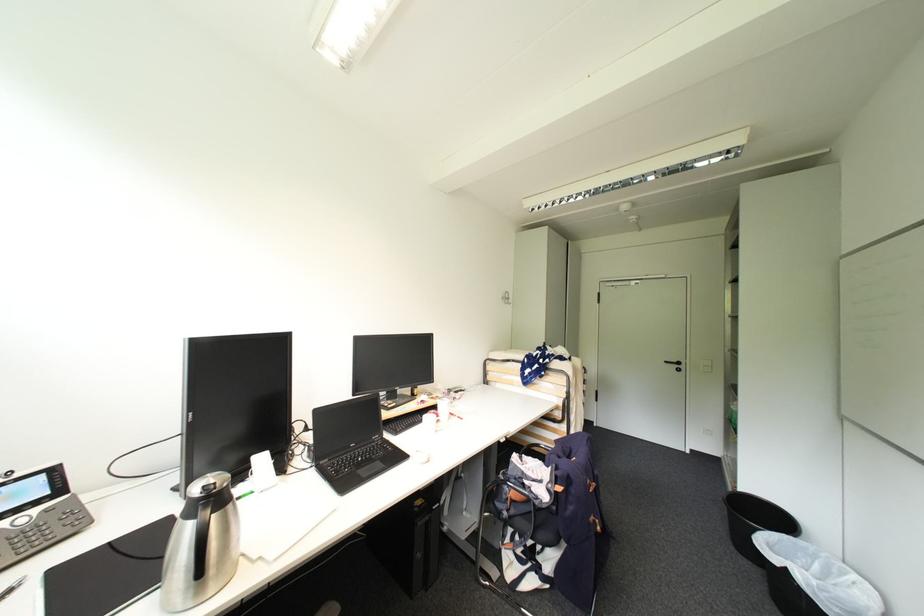
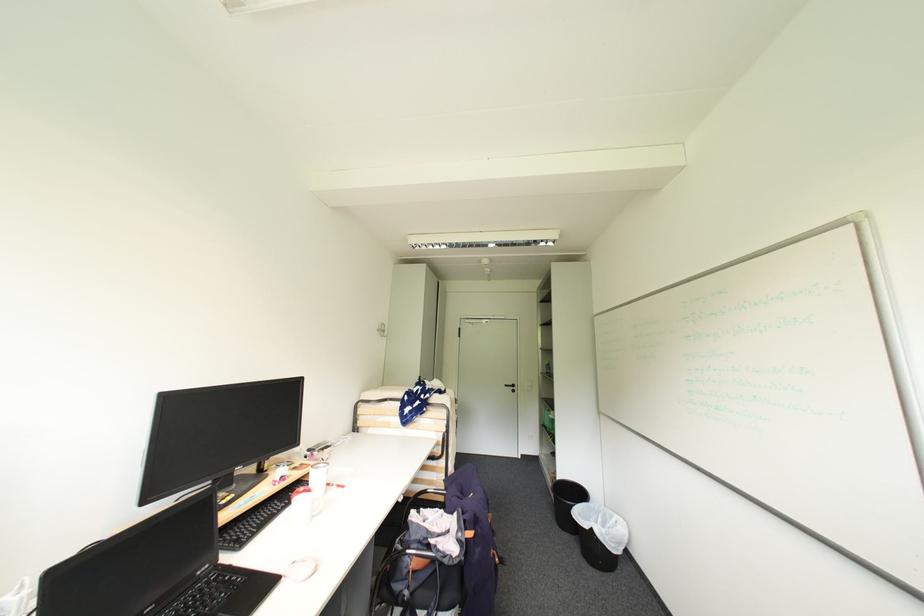
Where in the second image is the point corresponding to (x=507, y=442) from the first image?

(407, 501)